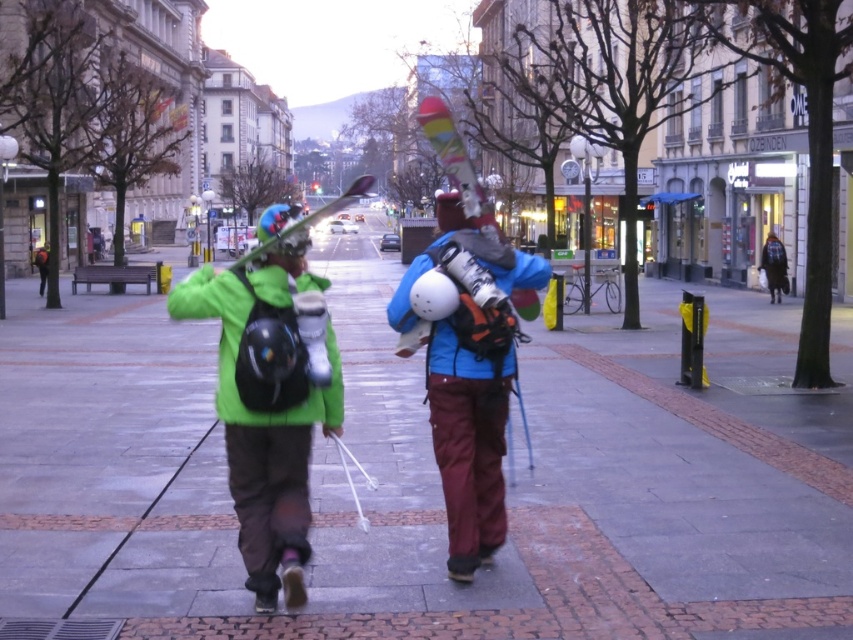
Question: Which object is the farthest from the matte blue snowboard at center?

Choices:
 (A) gray concrete pavement at center
 (B) matte green ski at center
 (C) matte green jacket at center

Answer: (B)

Question: Is matte green jacket at center positioned behind matte green ski at center?

Choices:
 (A) no
 (B) yes

Answer: (A)

Question: Which point is closer to the camera?

Choices:
 (A) (396, 353)
 (B) (656, 464)
 (C) (325, 214)

Answer: (A)

Question: Is matte blue snowboard at center positioned behind matte green ski at center?

Choices:
 (A) no
 (B) yes

Answer: (B)

Question: Where is gray concrete pavement at center located in relation to matte blue snowboard at center in the image?

Choices:
 (A) left
 (B) right

Answer: (B)

Question: Which of these objects is positioned farthest from the matte green jacket at center?

Choices:
 (A) matte green ski at center
 (B) gray concrete pavement at center
 (C) matte blue snowboard at center

Answer: (A)